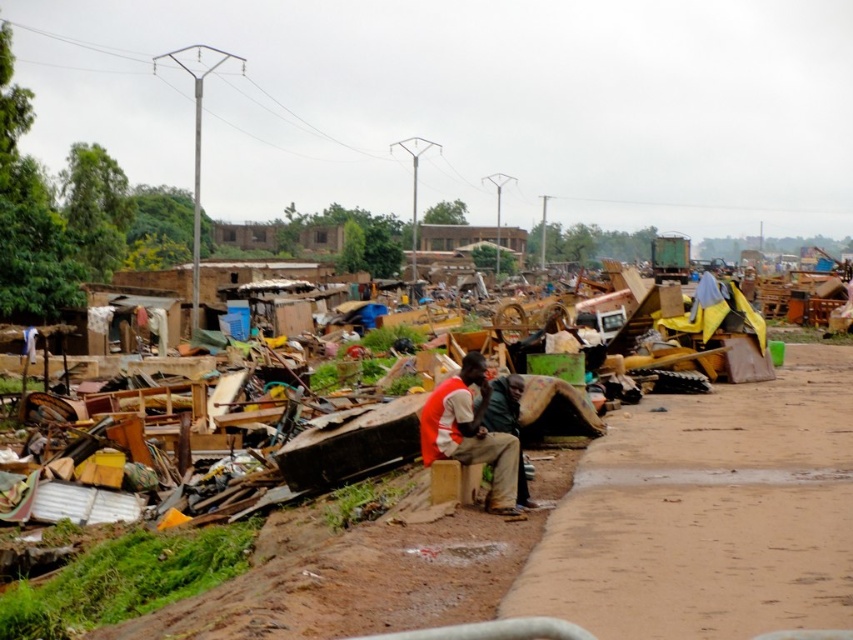
Does point (460, 436) lie in front of point (509, 376)?

Yes, it is in front of point (509, 376).

Which of these two, orange fabric shirt at center or green fabric jacket at center, stands shorter?

Standing shorter between the two is green fabric jacket at center.

This screenshot has height=640, width=853. Describe the element at coordinates (469, 433) in the screenshot. I see `orange fabric shirt at center` at that location.

Where is `orange fabric shirt at center`? This screenshot has width=853, height=640. orange fabric shirt at center is located at coordinates (469, 433).

Can you confirm if brown dirt pavement at lower right is wider than orange fabric shirt at center?

Yes, brown dirt pavement at lower right is wider than orange fabric shirt at center.

Which is behind, point (788, 508) or point (439, 403)?

The point (439, 403) is more distant.

You are a GUI agent. You are given a task and a screenshot of the screen. Output one action in this format:
    pyautogui.click(x=<x>, y=<y>)
    Task: Click on the brown dirt pavement at lower right
    
    Given the screenshot: What is the action you would take?
    pyautogui.click(x=708, y=513)

Is brown dirt pavement at lower right bigger than green fabric jacket at center?

Yes.

Does point (753, 428) come farther from viewer compared to point (514, 426)?

Yes, point (753, 428) is farther from viewer.

The width and height of the screenshot is (853, 640). Identify the location of brown dirt pavement at lower right. (708, 513).